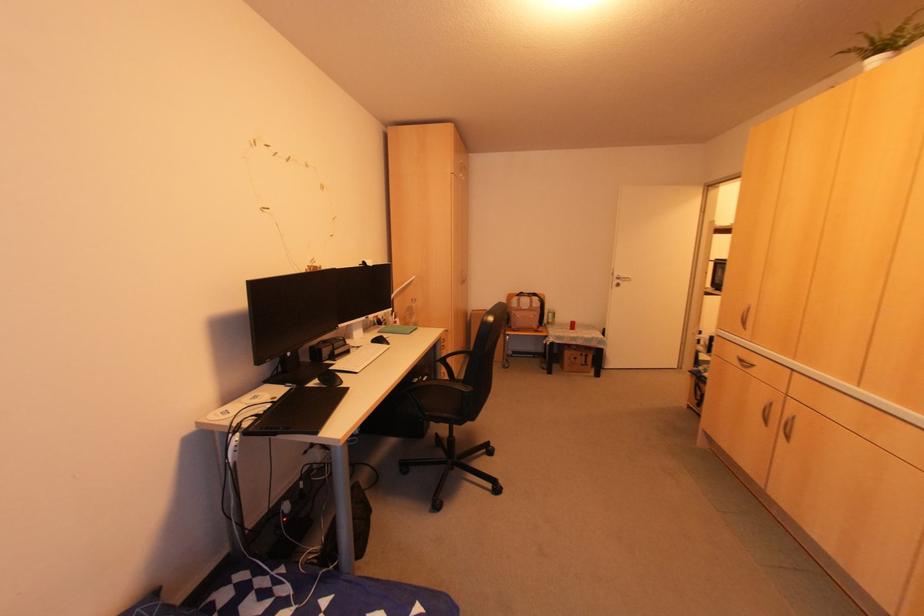
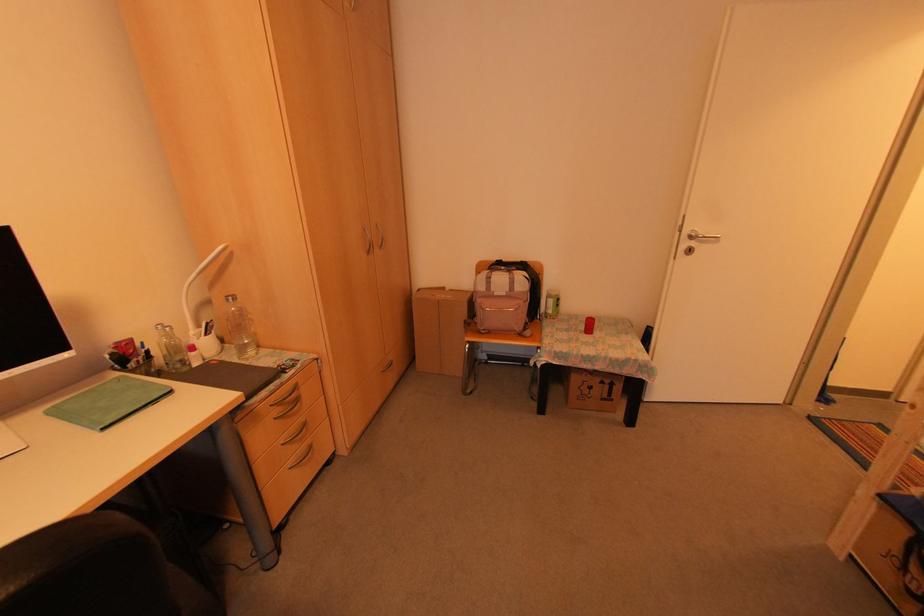
In the second image, find the point that corresponds to pixel 545 323 in the first image.

(543, 314)